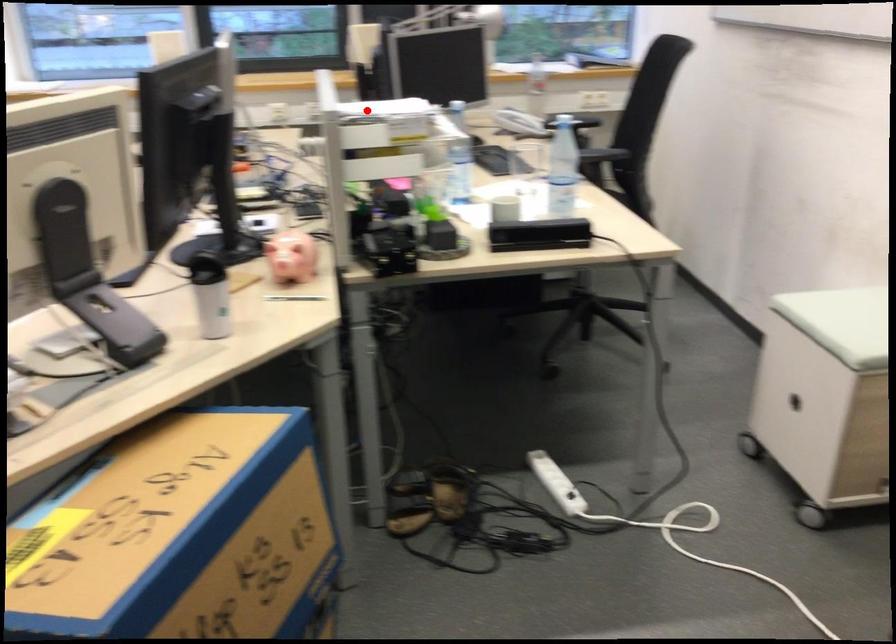
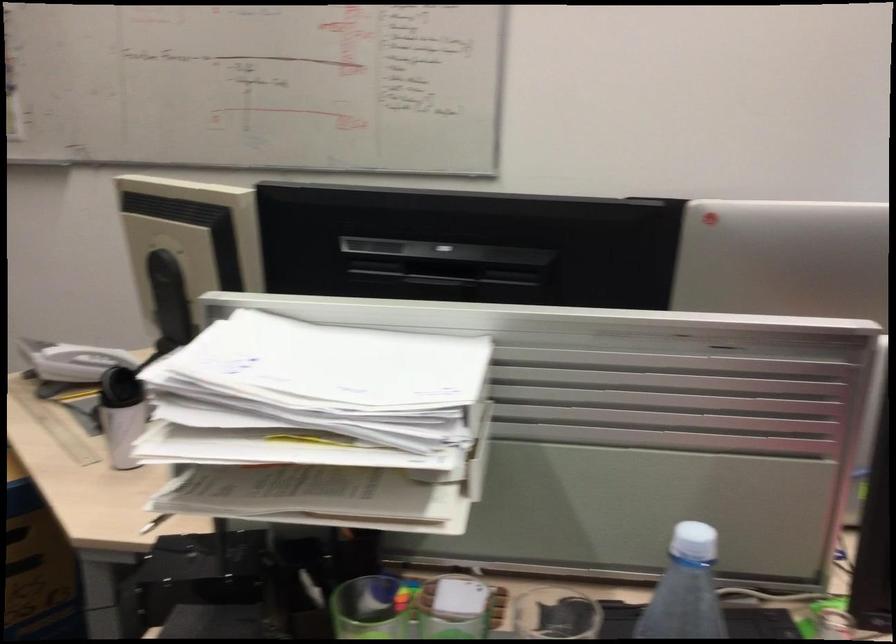
The point at the highlighted location is marked in the first image. Where is the corresponding point in the second image?

(333, 365)